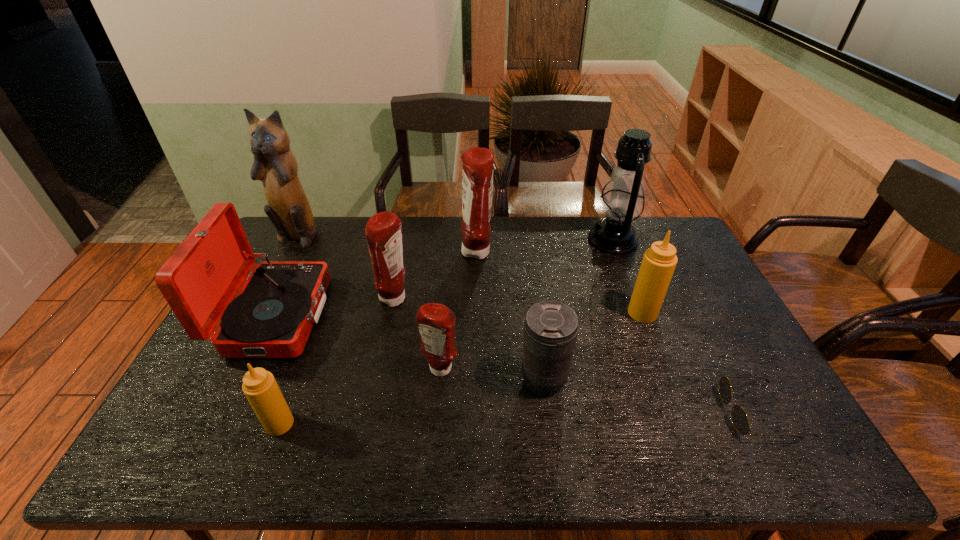
Identify the location of the second nearest condiment. This screenshot has height=540, width=960. (436, 322).

Find the location of `the smallest red condiment`. the smallest red condiment is located at coordinates (436, 322).

The image size is (960, 540). Identify the location of the nearer tan condiment. (259, 386).

Identify the location of the nearest condiment. This screenshot has height=540, width=960. (259, 386).

Identify the location of the rightmost object. The width and height of the screenshot is (960, 540). (740, 420).

What are the coordinates of `sunglasses` in the screenshot? It's located at (740, 420).

This screenshot has height=540, width=960. In order to click on vacant space located on the face of the cat in this screenshot , I will do `click(260, 303)`.

This screenshot has width=960, height=540. What are the coordinates of `vacant region located 0.120m on the right of the oil lamp` in the screenshot? It's located at (670, 240).

Locate an element on the screen. free space located on the front of the farthest condiment is located at coordinates (476, 298).

Locate an element on the screen. The height and width of the screenshot is (540, 960). free space located on the front-facing side of the phonograph_record is located at coordinates (410, 316).